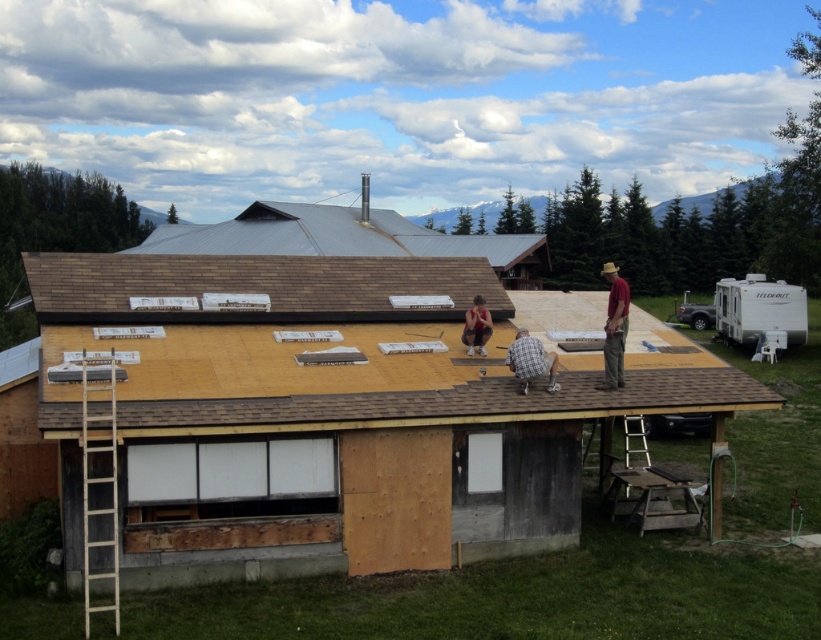
You are a construction worker standing on the roof of the house. You need to move from the brown shingles at upper center to the edge of the roof where the third worker is positioned. The distance between these two points is crucial for safety. What is the minimum safe distance you should maintain from the edge to avoid falling?

The minimum safe distance you should maintain from the edge is at least half the distance between the brown shingles at upper center and the edge, which is approximately 7.96 meters.

You are an inspector checking the roof structure of the house. You notice the brown shingles at upper center and the metallic gray roof at upper center. Which part of the roof is shorter in height?

The brown shingles at upper center is not as tall as the metallic gray roof at upper center, so the brown shingles at upper center is shorter in height.

You are an inspector checking the safety of the construction site. You notice two workers at the center of the roof wearing a plaid fabric shirt at center and matte black shorts at center. Which clothing item is shorter in height?

The plaid fabric shirt at center is not as tall as matte black shorts at center, so the plaid fabric shirt at center is shorter in height.